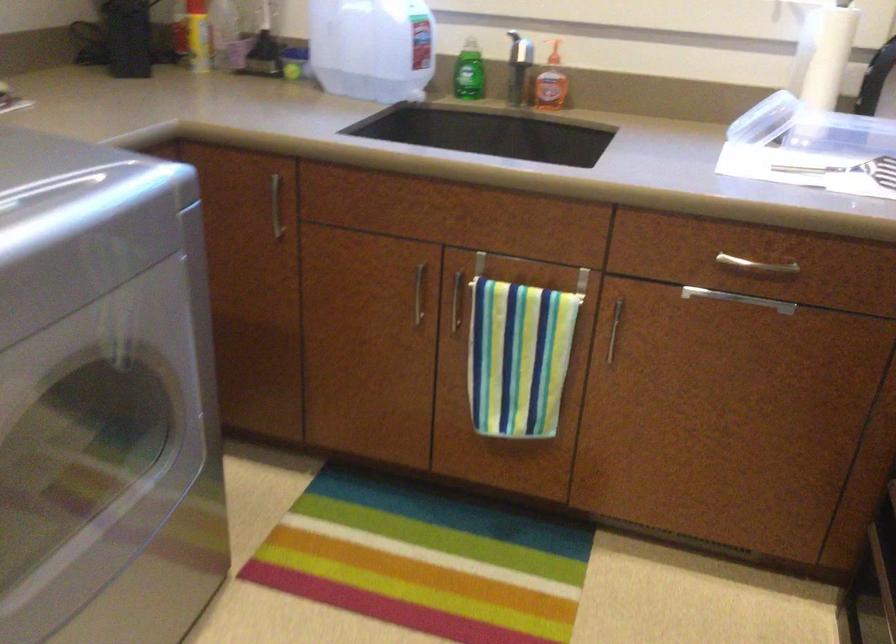
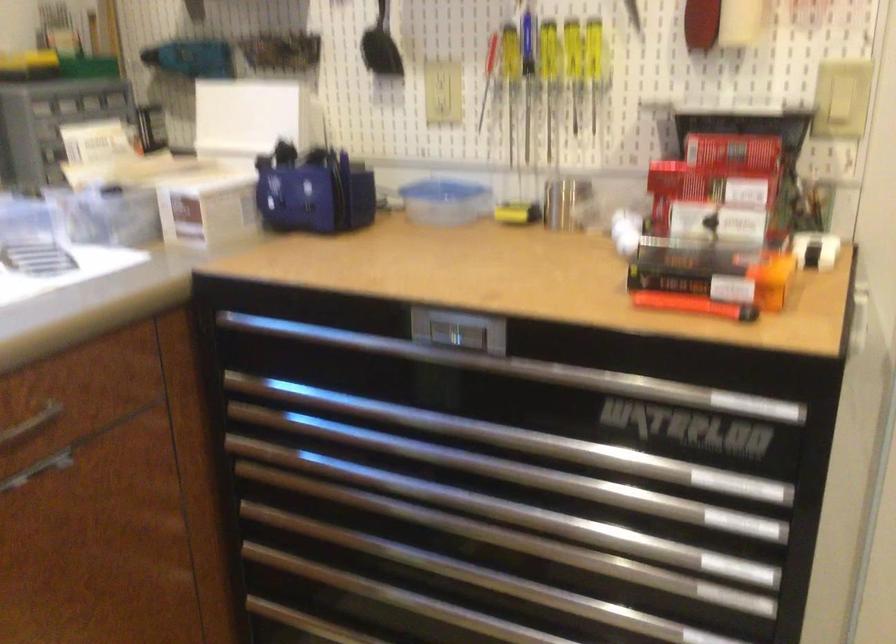
The images are taken continuously from a first-person perspective. In which direction is your viewpoint rotating?

The camera rotated toward right-down.